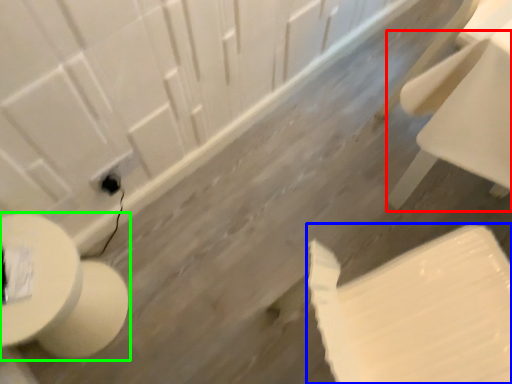
Question: Considering the real-world distances, which object is farthest from chair (highlighted by a red box)? toilet paper (highlighted by a blue box) or toilet (highlighted by a green box)?

Choices:
 (A) toilet paper
 (B) toilet

Answer: (B)